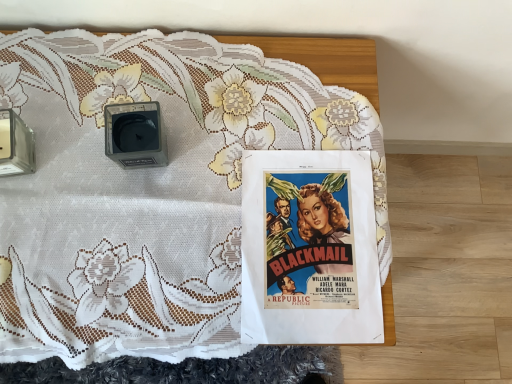
Question: Are matte black alarm clock at upper left and white lace tablecloth at center beside each other?

Choices:
 (A) yes
 (B) no

Answer: (B)

Question: Considering the relative sizes of matte black alarm clock at upper left and white lace tablecloth at center in the image provided, is matte black alarm clock at upper left thinner than white lace tablecloth at center?

Choices:
 (A) yes
 (B) no

Answer: (A)

Question: From the image's perspective, is matte black alarm clock at upper left under white lace tablecloth at center?

Choices:
 (A) yes
 (B) no

Answer: (B)

Question: Is matte black alarm clock at upper left to the left of white lace tablecloth at center from the viewer's perspective?

Choices:
 (A) yes
 (B) no

Answer: (A)

Question: Does matte black alarm clock at upper left appear on the right side of white lace tablecloth at center?

Choices:
 (A) yes
 (B) no

Answer: (B)

Question: From the image's perspective, is vivid paper poster at center above or below matte black alarm clock at upper left?

Choices:
 (A) below
 (B) above

Answer: (A)

Question: Considering the positions of vivid paper poster at center and matte black alarm clock at upper left in the image, is vivid paper poster at center taller or shorter than matte black alarm clock at upper left?

Choices:
 (A) tall
 (B) short

Answer: (B)

Question: From a real-world perspective, is vivid paper poster at center physically located above or below matte black alarm clock at upper left?

Choices:
 (A) above
 (B) below

Answer: (B)

Question: Is point (259, 215) closer or farther from the camera than point (153, 130)?

Choices:
 (A) closer
 (B) farther

Answer: (A)

Question: In terms of size, does white lace tablecloth at center appear bigger or smaller than vivid paper poster at center?

Choices:
 (A) small
 (B) big

Answer: (B)

Question: Considering the positions of point (200, 142) and point (270, 302), is point (200, 142) closer or farther from the camera than point (270, 302)?

Choices:
 (A) closer
 (B) farther

Answer: (B)

Question: Is white lace tablecloth at center inside the boundaries of vivid paper poster at center, or outside?

Choices:
 (A) inside
 (B) outside

Answer: (B)

Question: From a real-world perspective, is white lace tablecloth at center physically located above or below vivid paper poster at center?

Choices:
 (A) above
 (B) below

Answer: (B)

Question: Is vivid paper poster at center bigger or smaller than white lace tablecloth at center?

Choices:
 (A) big
 (B) small

Answer: (B)

Question: From the image's perspective, relative to white lace tablecloth at center, is vivid paper poster at center above or below?

Choices:
 (A) below
 (B) above

Answer: (A)